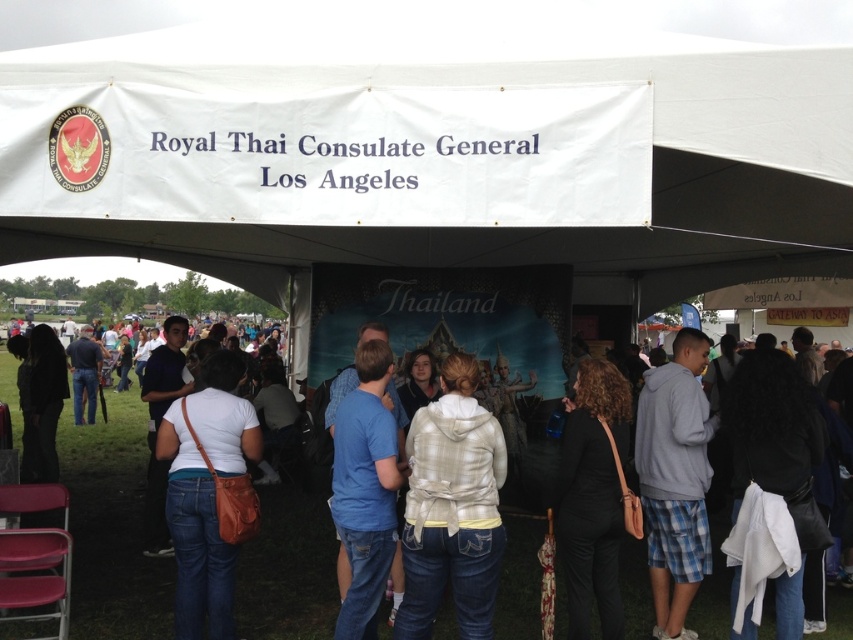
You are organizing a photo shoot for a clothing line and need to decide which garment takes up less visual space in the frame. You have two options under the tent at the event, the white plaid hoodie at center and the white matte shirt at center. Which one should you choose?

The white plaid hoodie at center occupies less space than the white matte shirt at center, so you should choose the white plaid hoodie at center for the photo shoot.

You are attending the event and want to take a photo of the banner and the Thai temple illustration on the backdrop. You notice two people wearing a gray fleece hoodie at center and black matte pants at lower center. Which clothing item is positioned higher up in the image?

The gray fleece hoodie at center is taller than the black matte pants at lower center, so the gray fleece hoodie at center is positioned higher up in the image.

You are at the Royal Thai Consulate General Los Angeles event. There are two points marked in the image. One is at point coordinates point (827, 3) and the other is at point (410, 426). From your perspective standing at the event, which point is closer to you?

Point (410, 426) is closer to you because it is in front of point (827, 3) according to their positions.